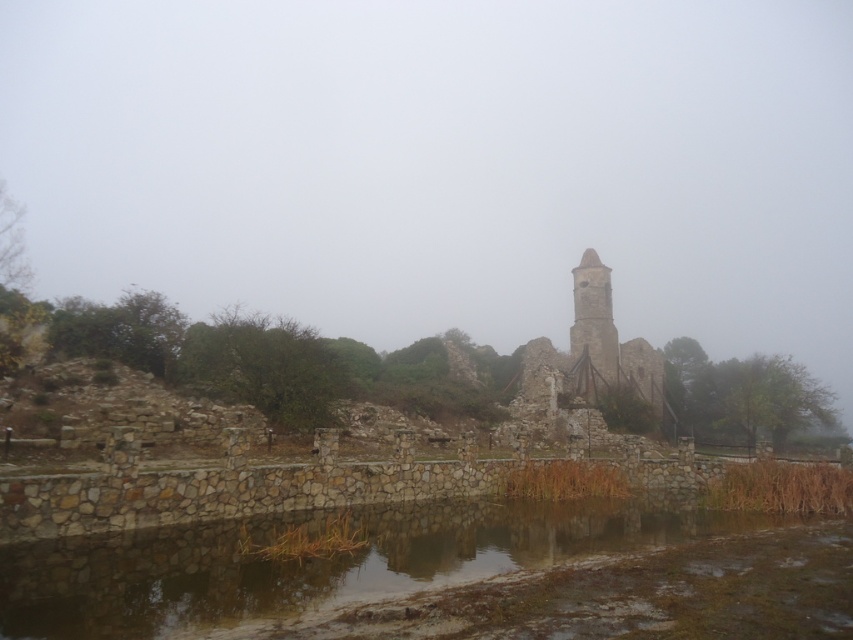
You are an architect examining the image of an old stone structure. You notice two towers labeled as rustic stone tower at center and rustic stone bell tower at center. Which one is positioned lower in the image?

The rustic stone tower at center is positioned lower than the rustic stone bell tower at center according to the description.

You are standing in front of the rustic stone tower at center and want to cross to the other side of the smooth stone river at center. Which direction should you look to find the nearest path across the river?

The smooth stone river at center is closer to the viewer than the rustic stone tower at center, so you should look towards the direction where the smooth stone river at center is nearest to the rustic stone tower at center to find the nearest path across the river.

You are a construction worker planning to build a bridge between the smooth stone river at center and the rustic stone tower at center. The bridge you have is 35 meters long. Will it be sufficient to connect them?

The smooth stone river at center and rustic stone tower at center are 36.08 meters apart from each other. The bridge is 35 meters long, which is shorter than the required distance. Therefore, the bridge will not be sufficient to connect them.